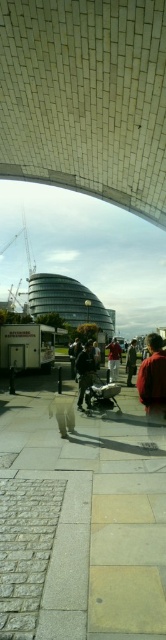
Question: Among these objects, which one is nearest to the camera?

Choices:
 (A) red fabric jacket at center
 (B) dark gray fabric jacket at center

Answer: (B)

Question: Which point appears farthest from the camera in this image?

Choices:
 (A) (119, 353)
 (B) (132, 362)
 (C) (87, 369)

Answer: (B)

Question: Which of the following is the farthest from the observer?

Choices:
 (A) (109, 369)
 (B) (83, 365)
 (C) (130, 342)

Answer: (C)

Question: Is dark gray fabric jacket at center to the right of dark brown leather jacket at center from the viewer's perspective?

Choices:
 (A) yes
 (B) no

Answer: (B)

Question: Is dark gray fabric jacket at center below red fabric jacket at center?

Choices:
 (A) yes
 (B) no

Answer: (B)

Question: Does dark gray fabric jacket at center appear under dark brown leather jacket at center?

Choices:
 (A) no
 (B) yes

Answer: (A)